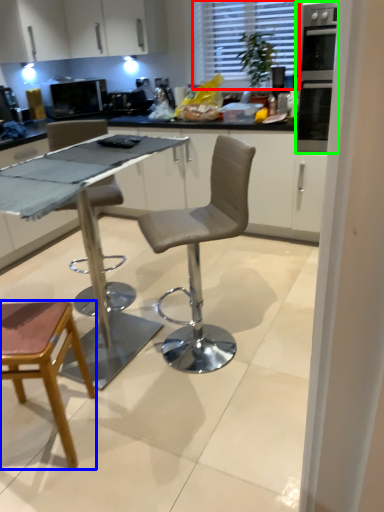
Question: Considering the real-world distances, which object is closest to window (highlighted by a red box)? chair (highlighted by a blue box) or oven (highlighted by a green box).

Choices:
 (A) chair
 (B) oven

Answer: (B)